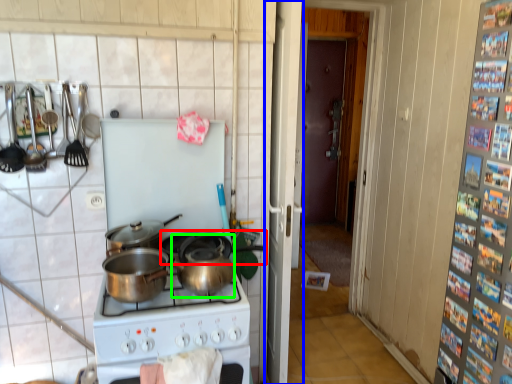
Question: Which object is the farthest from wok (highlighted by a red box)? Choose among these: screen door (highlighted by a blue box) or crock pot (highlighted by a green box).

Choices:
 (A) screen door
 (B) crock pot

Answer: (A)